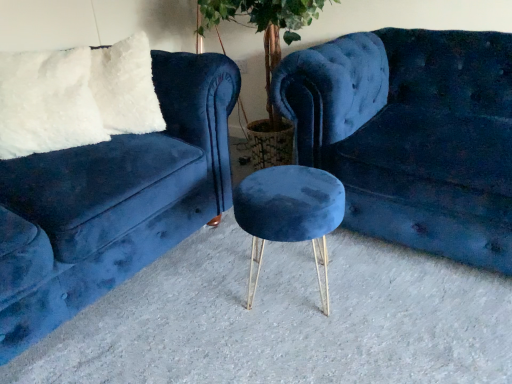
Locate an element on the screen. The width and height of the screenshot is (512, 384). unoccupied region to the right of velvet blue stool at center is located at coordinates (380, 279).